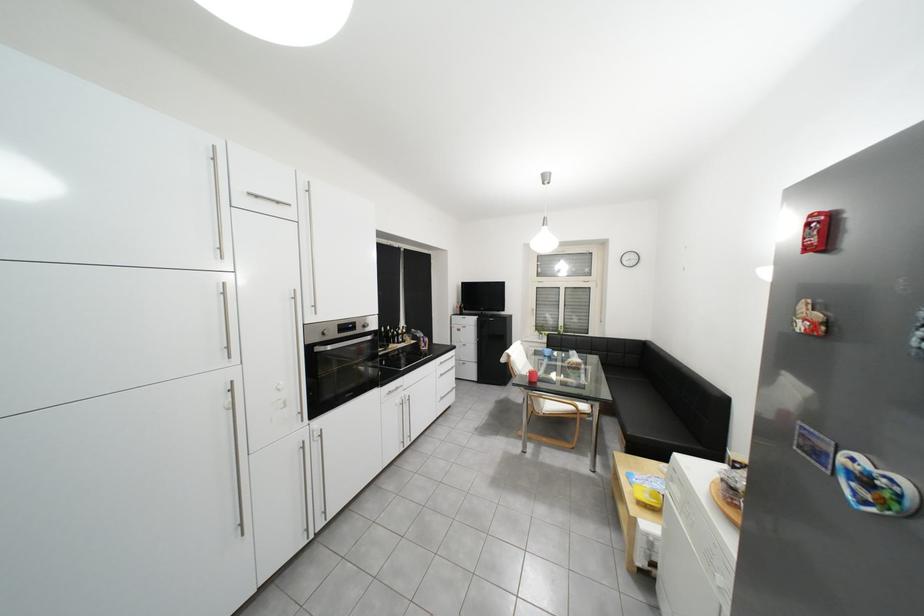
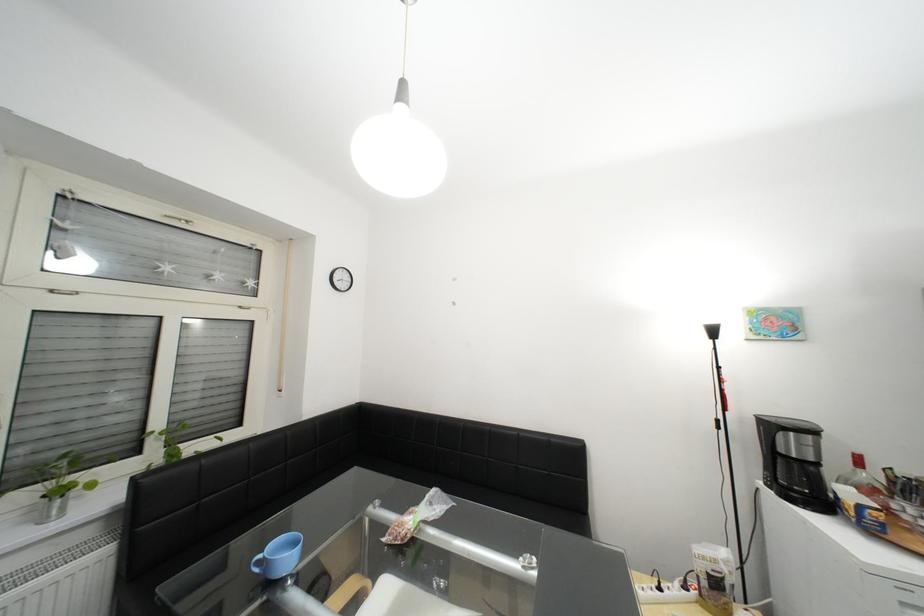
Question: I am providing you with two images of the same scene from different viewpoints. Which of the following objects are not visible in image2?

Choices:
 (A) plastic snack bag
 (B) blue capped pen
 (C) window handle
 (D) sofa sitting surface

Answer: (D)